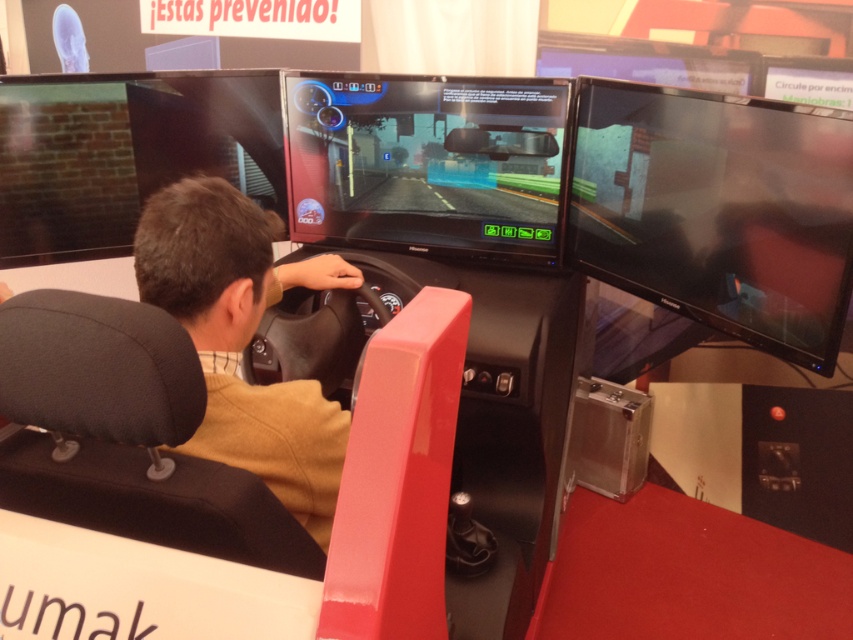
Where is the matte black monitor at center located in the coordinate system of the image?

The matte black monitor at center is located at point coordinates of (427,161).